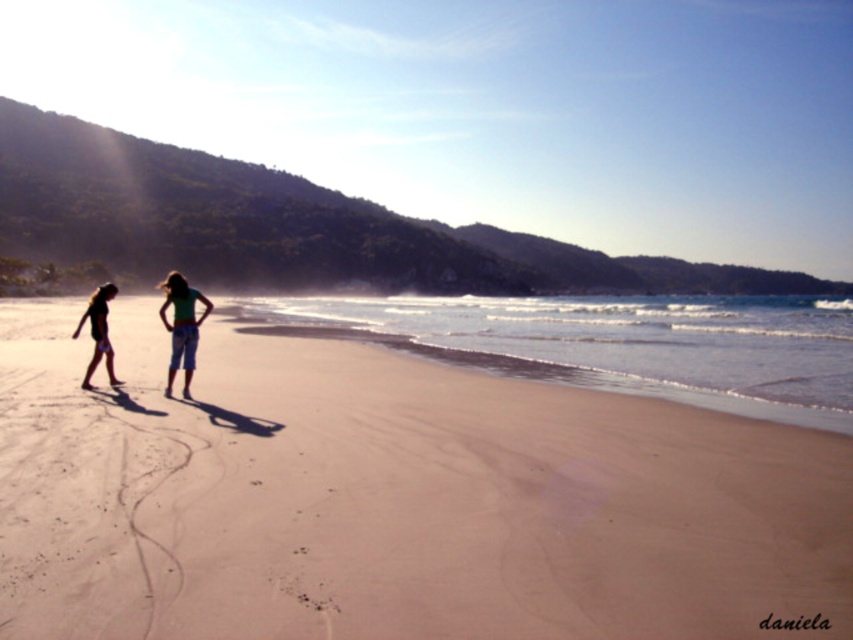
You are a drone operator trying to capture a photo of the sandy shore at lower center and the matte black shorts at left. The minimum distance your drone can focus is 100 feet. Can your drone capture both objects in focus at the same time?

The sandy shore at lower center and the matte black shorts at left are 182.82 feet apart from each other. Since the distance between them is greater than the minimum focus distance of 100 feet, the drone can capture both objects in focus simultaneously.

You are standing at the center of the image and want to walk to the sandy shore at lower center. Which direction should you move to reach it?

The sandy shore at lower center is located at coordinates point (622, 342), so you should move towards the lower center direction to reach it.

You are standing on the beach and see two points marked on the sand. One is at point (714, 372) and the other at point (189, 344). Which point is closer to you?

Point (189, 344) is closer to you because it is nearer than point (714, 372), which is further away.